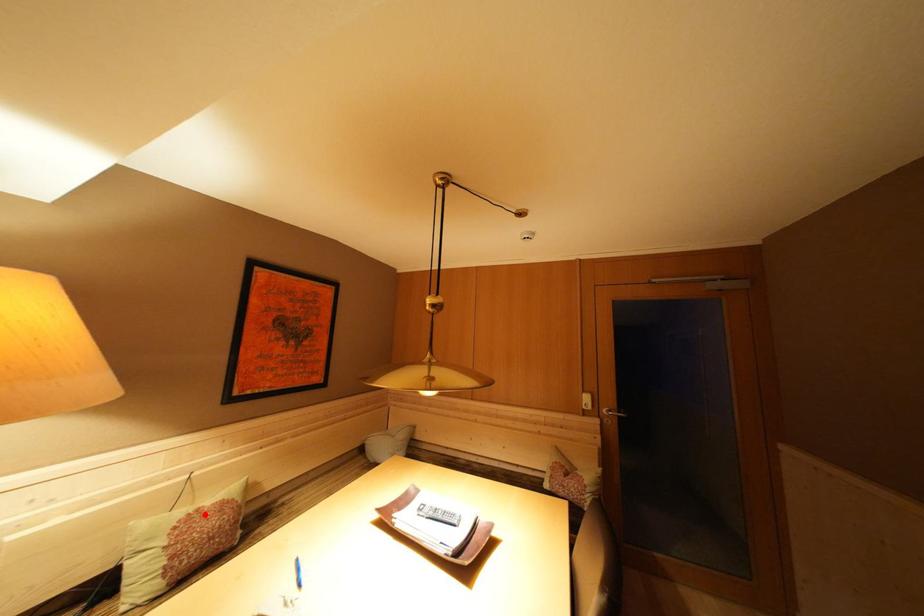
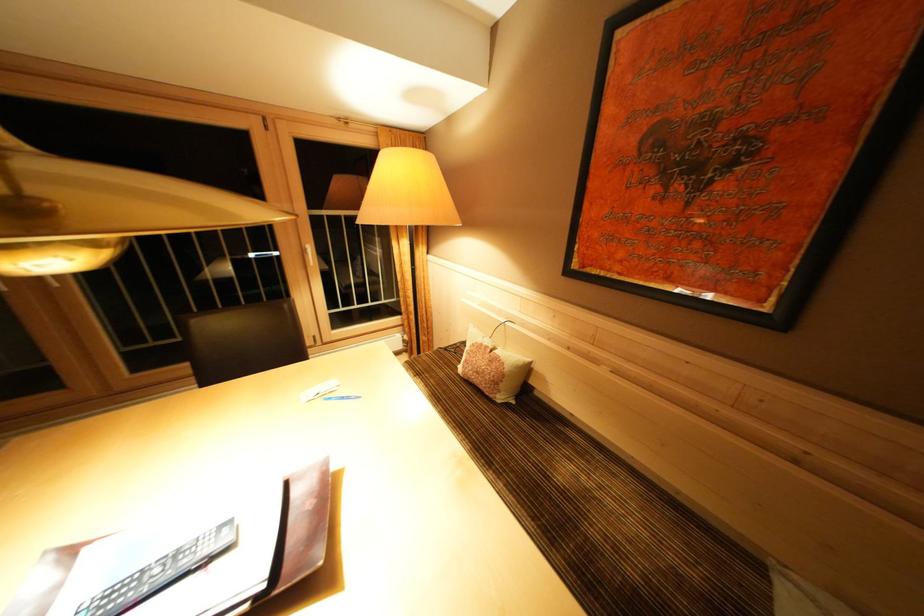
Locate, in the second image, the point that corresponds to the highlighted location in the first image.

(493, 352)